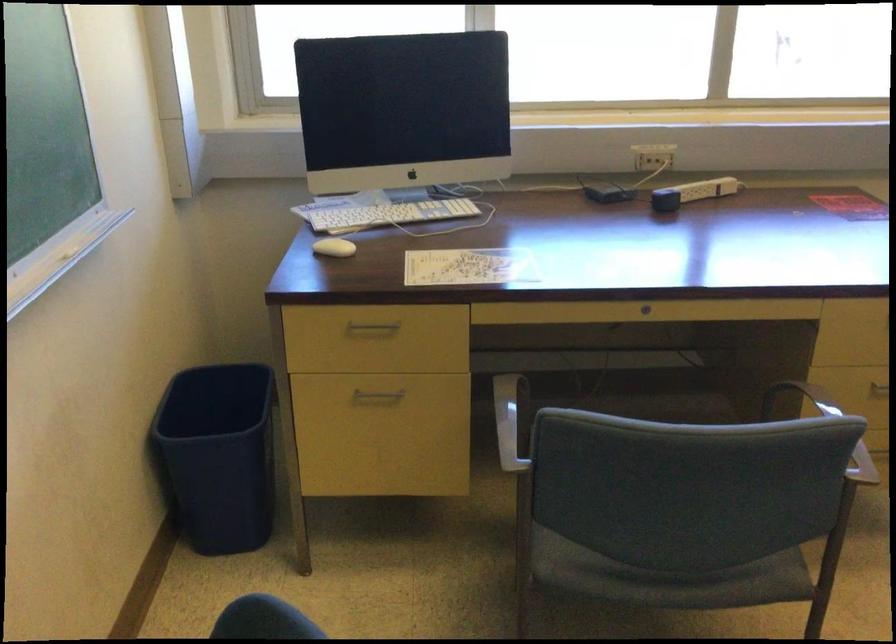
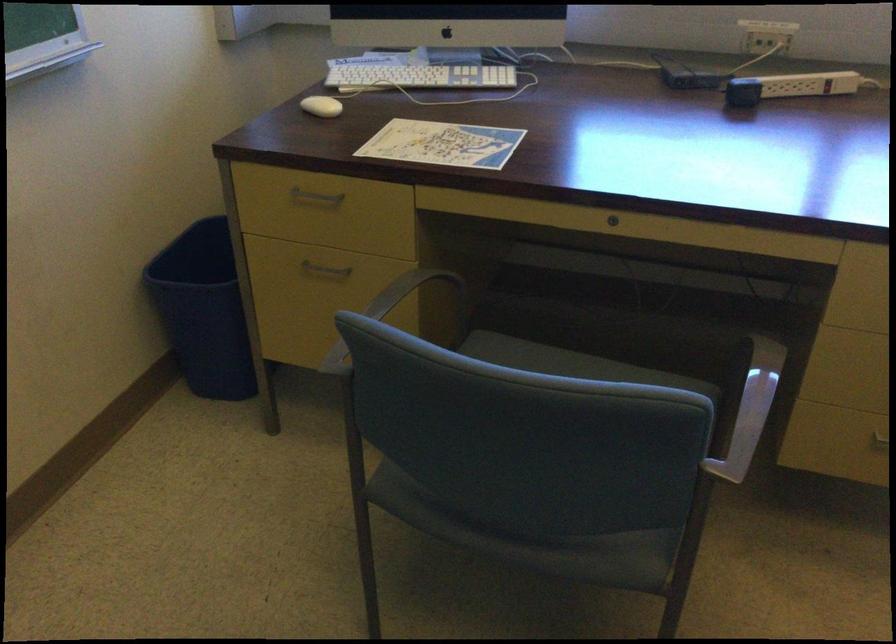
Find the pixel in the second image that matches [371,324] in the first image.

(315, 196)